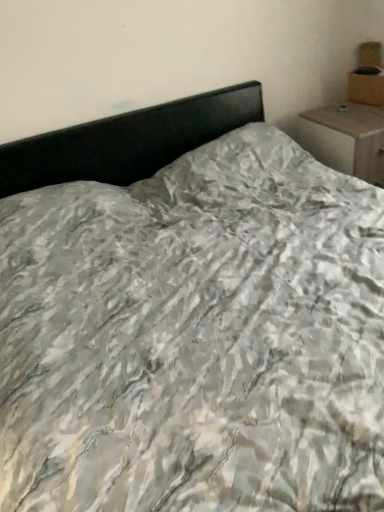
Question: Is cardboard box at upper right in front of or behind wooden nightstand at upper right in the image?

Choices:
 (A) front
 (B) behind

Answer: (B)

Question: From the image's perspective, is cardboard box at upper right located above or below wooden nightstand at upper right?

Choices:
 (A) above
 (B) below

Answer: (A)

Question: Which is correct: cardboard box at upper right is inside wooden nightstand at upper right, or outside of it?

Choices:
 (A) inside
 (B) outside

Answer: (B)

Question: In terms of size, does wooden nightstand at upper right appear bigger or smaller than cardboard box at upper right?

Choices:
 (A) small
 (B) big

Answer: (B)

Question: Choose the correct answer: Is wooden nightstand at upper right inside cardboard box at upper right or outside it?

Choices:
 (A) inside
 (B) outside

Answer: (B)

Question: In terms of width, does wooden nightstand at upper right look wider or thinner when compared to cardboard box at upper right?

Choices:
 (A) thin
 (B) wide

Answer: (B)

Question: Visually, is wooden nightstand at upper right positioned to the left or to the right of cardboard box at upper right?

Choices:
 (A) left
 (B) right

Answer: (A)